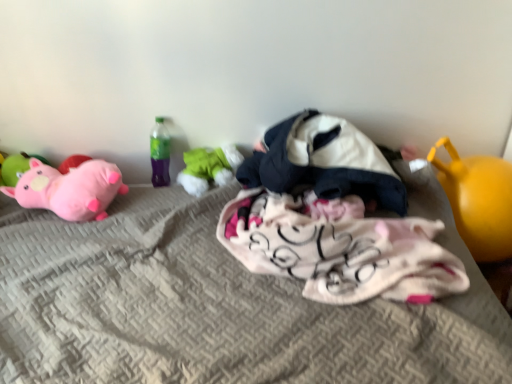
Question: Should I look upward or downward to see green fabric toy at center, the third toy when ordered from left to right?

Choices:
 (A) up
 (B) down

Answer: (A)

Question: Is matte pink plush at left, acting as the 2th toy starting from the left, facing towards pink plush pig at left, the 5th toy in the right-to-left sequence?

Choices:
 (A) no
 (B) yes

Answer: (A)

Question: From a real-world perspective, does matte pink plush at left, acting as the 4th toy starting from the right, stand above pink plush pig at left, the 5th toy in the right-to-left sequence?

Choices:
 (A) yes
 (B) no

Answer: (B)

Question: Is matte pink plush at left, acting as the 4th toy starting from the right, further to the viewer compared to pink plush pig at left, which is the first toy in left-to-right order?

Choices:
 (A) no
 (B) yes

Answer: (A)

Question: Is matte pink plush at left, acting as the 2th toy starting from the left, facing away from pink plush pig at left, the 5th toy in the right-to-left sequence?

Choices:
 (A) no
 (B) yes

Answer: (B)

Question: Considering the relative positions of matte pink plush at left, acting as the 2th toy starting from the left, and pink plush pig at left, the 5th toy in the right-to-left sequence, in the image provided, is matte pink plush at left, acting as the 2th toy starting from the left, to the left of pink plush pig at left, the 5th toy in the right-to-left sequence, from the viewer's perspective?

Choices:
 (A) yes
 (B) no

Answer: (B)

Question: Is matte pink plush at left, acting as the 2th toy starting from the left, taller than pink plush pig at left, the 5th toy in the right-to-left sequence?

Choices:
 (A) yes
 (B) no

Answer: (B)

Question: Considering the relative positions of white soft blanket at center, which is counted as the fourth toy, starting from the left, and textured gray mattress at center in the image provided, is white soft blanket at center, which is counted as the fourth toy, starting from the left, behind textured gray mattress at center?

Choices:
 (A) no
 (B) yes

Answer: (B)

Question: Considering the relative sizes of white soft blanket at center, placed as the 2th toy when sorted from right to left, and textured gray mattress at center in the image provided, is white soft blanket at center, placed as the 2th toy when sorted from right to left, shorter than textured gray mattress at center?

Choices:
 (A) no
 (B) yes

Answer: (B)

Question: Is white soft blanket at center, which is counted as the fourth toy, starting from the left, wider than textured gray mattress at center?

Choices:
 (A) no
 (B) yes

Answer: (A)

Question: Is white soft blanket at center, which is counted as the fourth toy, starting from the left, thinner than textured gray mattress at center?

Choices:
 (A) no
 (B) yes

Answer: (B)

Question: Is white soft blanket at center, which is counted as the fourth toy, starting from the left, positioned with its back to textured gray mattress at center?

Choices:
 (A) no
 (B) yes

Answer: (B)

Question: Would you say yellow rubber ball at right, acting as the fifth toy starting from the left, contains white soft blanket at center, placed as the 2th toy when sorted from right to left?

Choices:
 (A) yes
 (B) no

Answer: (B)